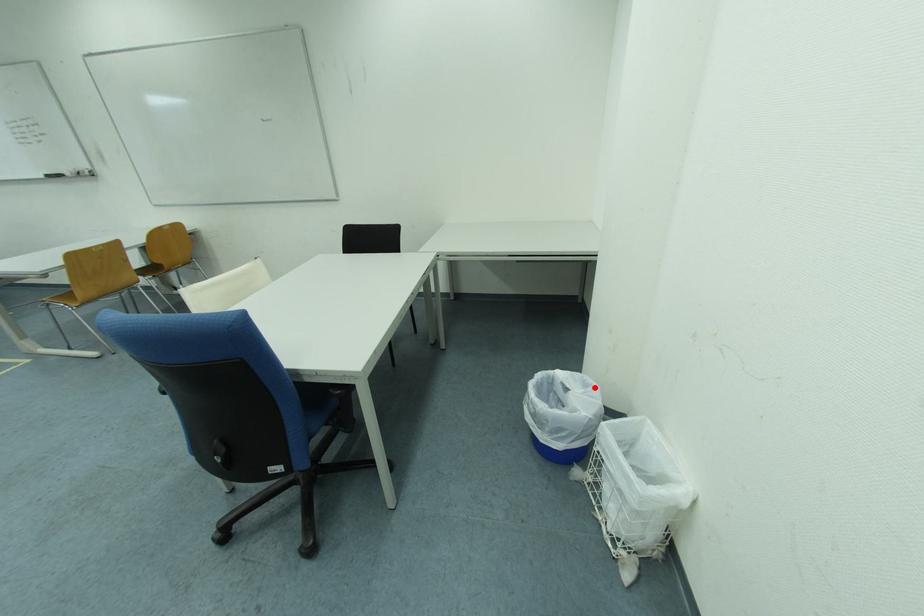
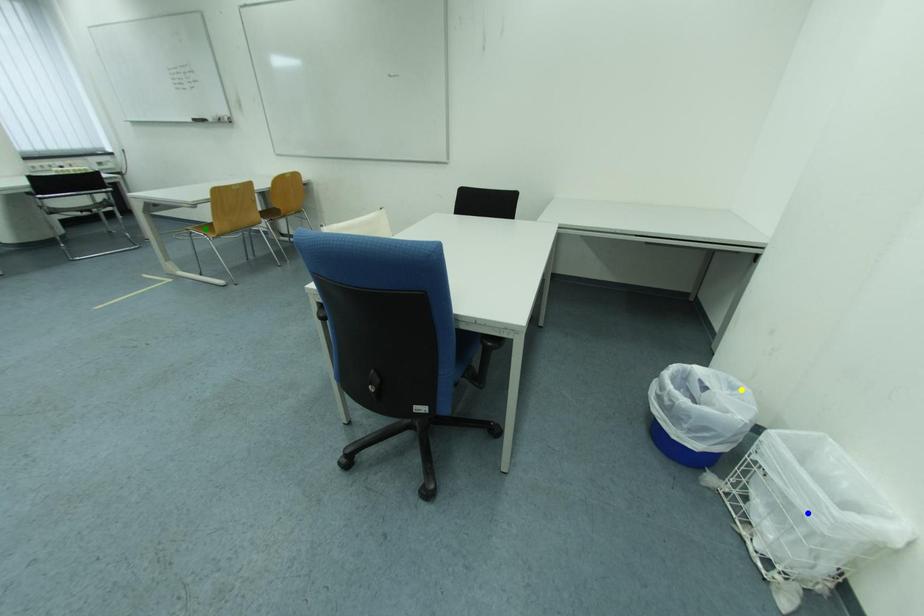
Question: I am providing you with two images of the same scene from different viewpoints. A red point is marked on the first image. You are given multiple points on the second image. Which point in image 2 represents the same 3d spot as the red point in image 1?

Choices:
 (A) green point
 (B) blue point
 (C) yellow point

Answer: (C)